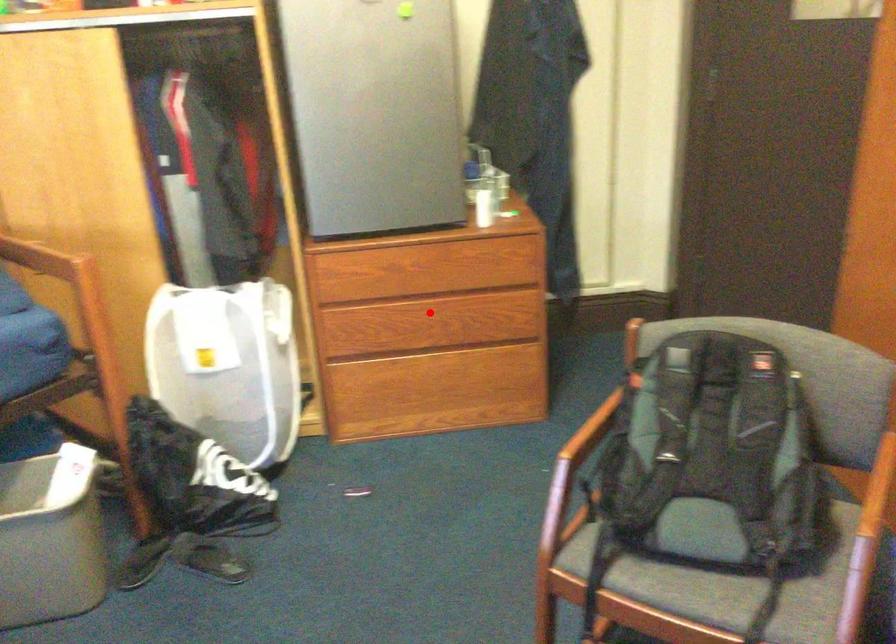
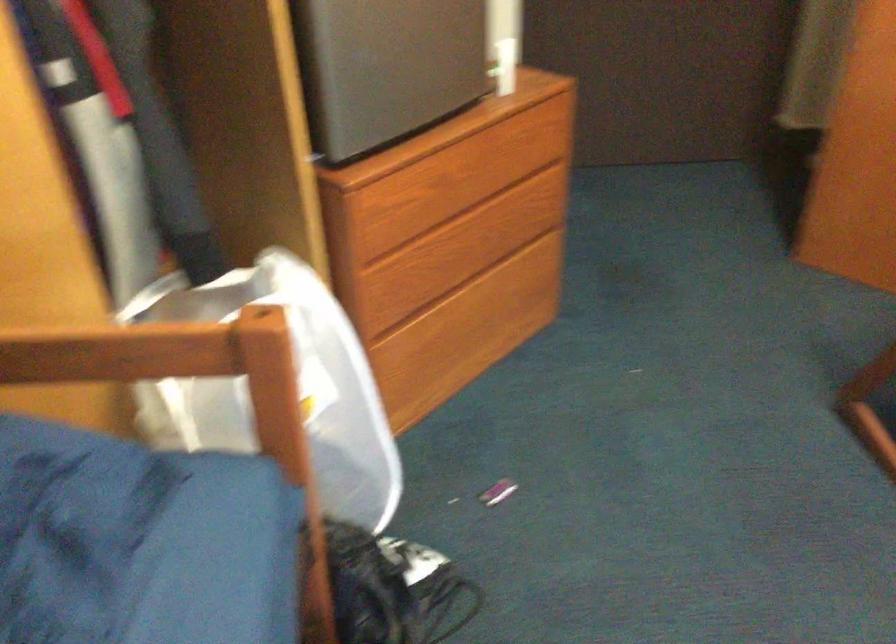
Find the pixel in the second image that matches the highlighted location in the first image.

(469, 225)